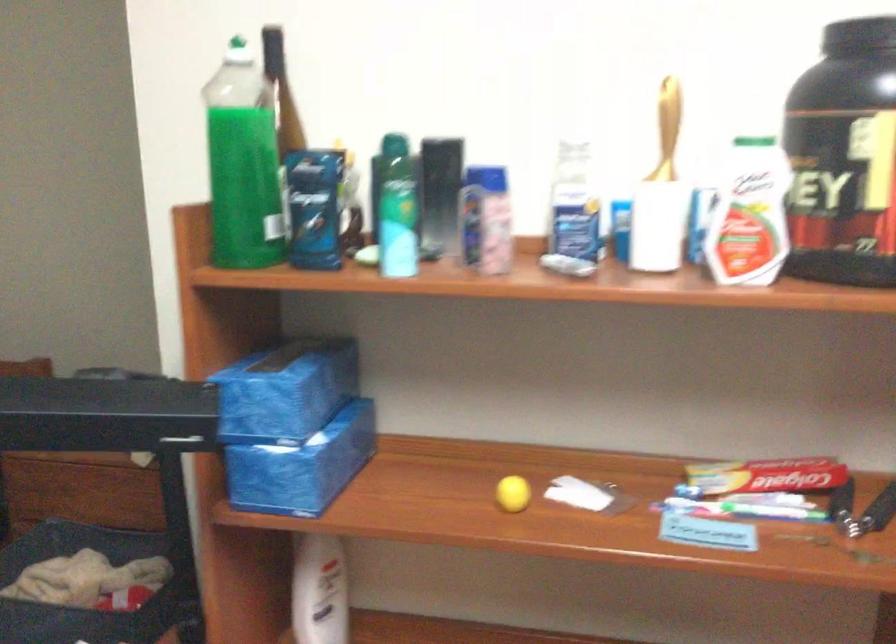
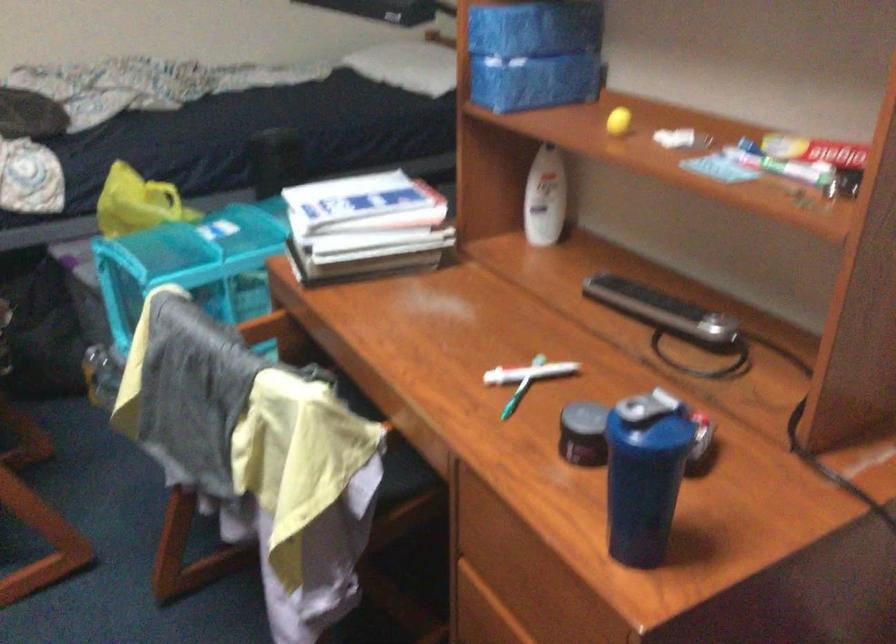
Locate, in the second image, the point that corresponds to (307,531) in the first image.

(541, 147)